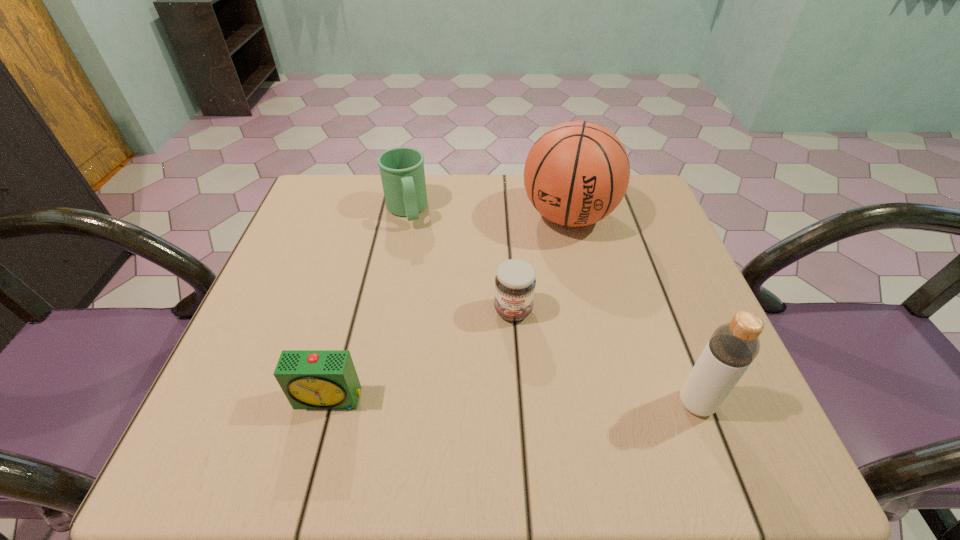
Find the location of `vacant space located on the front label of the third farthest object`. vacant space located on the front label of the third farthest object is located at coordinates (511, 364).

Find the location of a particular element. The height and width of the screenshot is (540, 960). free region located on the front label of the third farthest object is located at coordinates coord(512,350).

Locate an element on the screen. blank area located on the side of the mug with the handle is located at coordinates 420,266.

Find the location of a particular element. The image size is (960, 540). free spot located 0.260m on the side of the mug with the handle is located at coordinates (432, 307).

The width and height of the screenshot is (960, 540). Identify the location of vacant area located on the side of the mug with the handle. (439, 329).

Where is `basketball situated at the far edge`? basketball situated at the far edge is located at coordinates (577, 173).

Identify the location of mug positioned at the far edge. This screenshot has width=960, height=540. (402, 172).

I want to click on alarm clock that is at the near edge, so click(311, 379).

Where is `bottle at the near edge`? This screenshot has width=960, height=540. bottle at the near edge is located at coordinates (733, 346).

Find the location of a particular element. object that is positioned at the left edge is located at coordinates (311, 379).